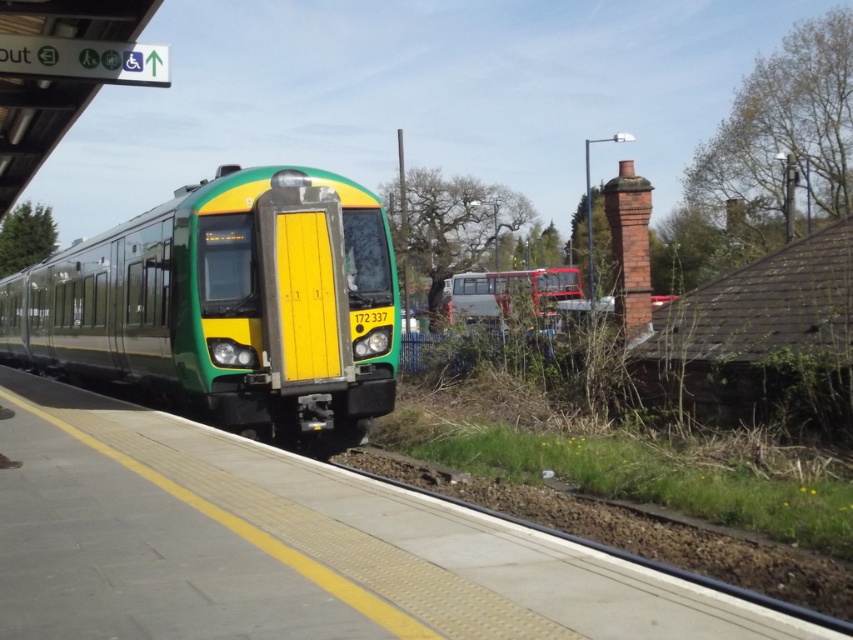
You are standing at the railway station and want to board the train marked with the number 172 337. Where should you go to find the concrete platform at center?

The concrete platform at center is located at the coordinates (294, 545), so you should go to that point to board the train marked with the number 172 337.

You are a pedestrian standing on the platform waiting for the train. You notice the brown gravel train track at lower center and the metallic silver bus at center. Which object is closer to your left side?

The brown gravel train track at lower center is positioned on the left side of metallic silver bus at center, so it is closer to your left side.

You are a maintenance worker checking the height clearance for a new overhead bridge that needs to accommodate the green matte train at center and the brown gravel train track at lower center. What is the minimum height required for the bridge to safely allow passage of the train?

The green matte train at center is taller than the brown gravel train track at lower center. Therefore, the minimum height required for the bridge should be at least the height of the green matte train at center to ensure safe passage.